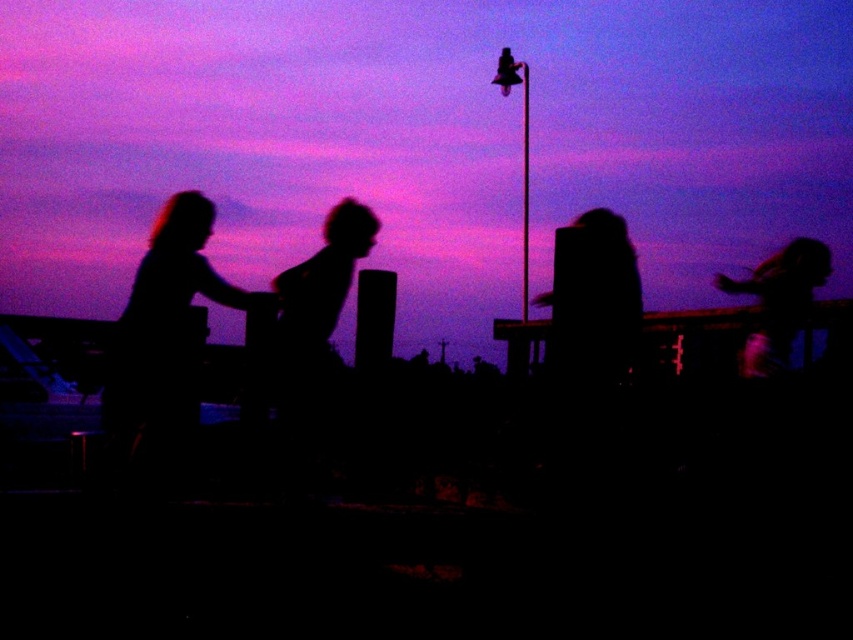
You are standing at the point marked by coordinates point (161, 340). Looking around, you see the silhouette hair at left. Which direction should you face to see the silhouette hair at left?

You should face to the left to see the silhouette hair at left.

You are standing at the lamppost and looking towards the purple and pink sky. There are two points marked in the scene. The first point is at coordinates point (117, 324) and the second point is at point (782, 250). Which point is closer to you?

Point (117, 324) is in front of point (782, 250), so it is closer to you.